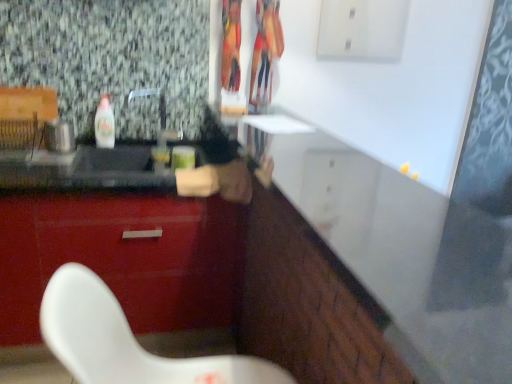
Question: From a real-world perspective, is white glossy counter at center above or below glossy red cabinet at lower left?

Choices:
 (A) below
 (B) above

Answer: (B)

Question: Would you say white glossy counter at center is to the left or to the right of glossy red cabinet at lower left in the picture?

Choices:
 (A) right
 (B) left

Answer: (A)

Question: Which is nearer to the glossy red cabinet at lower left?

Choices:
 (A) clear plastic bottle at left
 (B) white glossy counter at center

Answer: (A)

Question: Based on their relative distances, which object is nearer to the clear plastic bottle at left?

Choices:
 (A) glossy red cabinet at lower left
 (B) white glossy counter at center

Answer: (A)